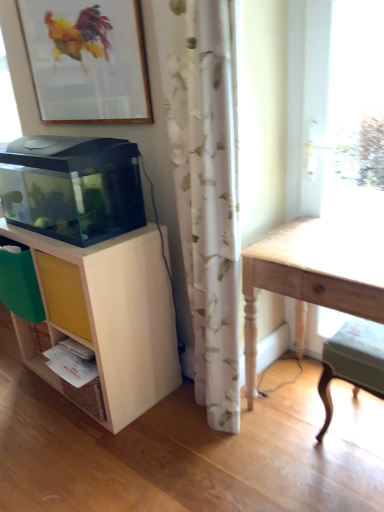
This screenshot has height=512, width=384. What are the coordinates of `vacant region in front of matte wood shelf at left` in the screenshot? It's located at (105, 454).